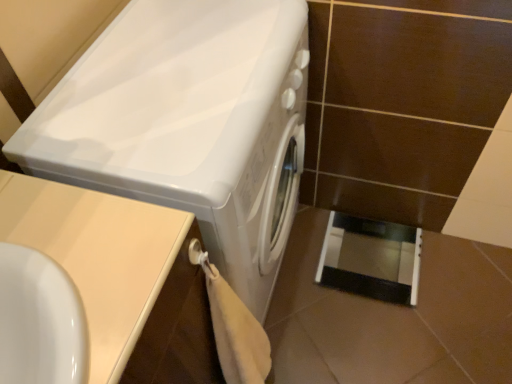
Where is `blank space situated above black glossy screen door at lower right (from a real-world perspective)`? This screenshot has width=512, height=384. blank space situated above black glossy screen door at lower right (from a real-world perspective) is located at coordinates (371, 255).